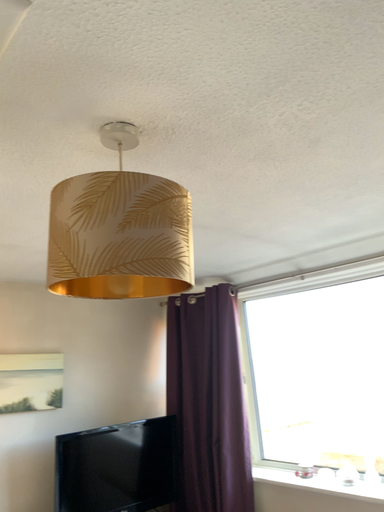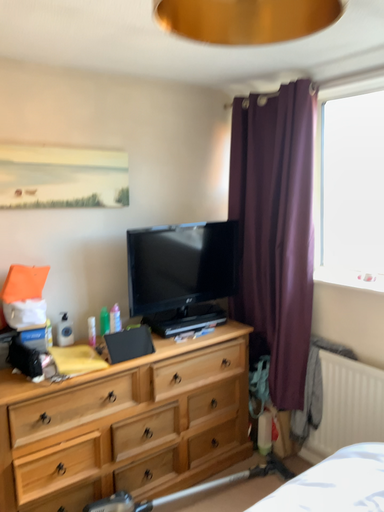
Question: How did the camera likely rotate when shooting the video?

Choices:
 (A) rotated upward
 (B) rotated downward

Answer: (B)